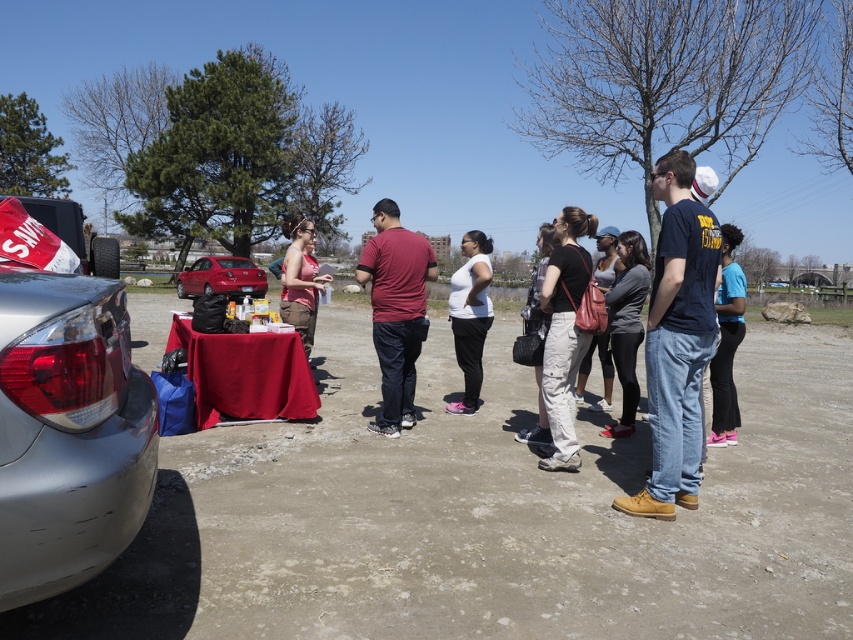
Who is positioned more to the left, matte black shirt at center or white matte shirt at center?

From the viewer's perspective, white matte shirt at center appears more on the left side.

Is matte black shirt at center wider than white matte shirt at center?

Yes.

The image size is (853, 640). Identify the location of matte black shirt at center. (564, 333).

Image resolution: width=853 pixels, height=640 pixels. Find the location of `matte black shirt at center`. matte black shirt at center is located at coordinates (564, 333).

Between point (485, 282) and point (712, 432), which one is positioned behind?

The point (485, 282) is more distant.

In the scene shown: Is white matte shirt at center above blue cotton shirt at right?

Yes.

The width and height of the screenshot is (853, 640). What are the coordinates of `white matte shirt at center` in the screenshot? It's located at (469, 316).

Is gray fabric jacket at center shorter than matte pink tank top at center?

Incorrect, gray fabric jacket at center's height does not fall short of matte pink tank top at center's.

Is point (625, 417) positioned before point (310, 305)?

Yes, it is.

Is point (630, 291) more distant than point (305, 232)?

No, (630, 291) is in front of (305, 232).

At what (x,y) coordinates should I click in order to perform the action: click on gray fabric jacket at center. Please return your answer as a coordinate pair (x, y). Looking at the image, I should click on (627, 324).